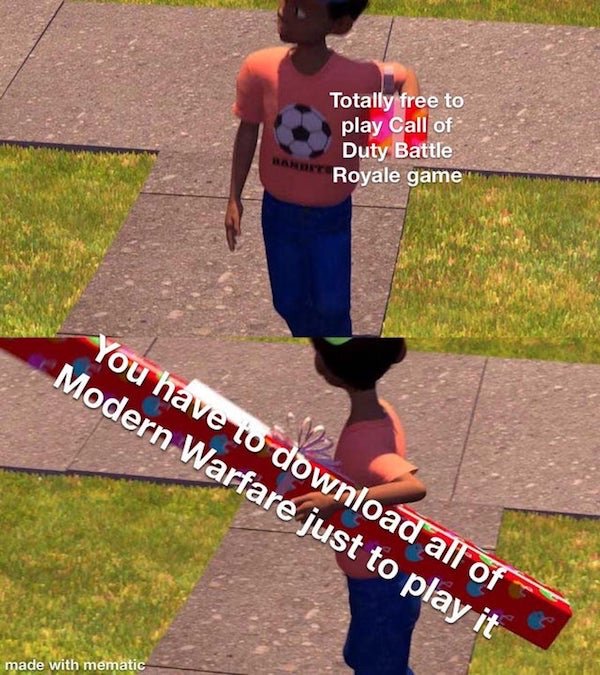
This screenshot has width=600, height=675. Identify the location of floor. (534, 68).